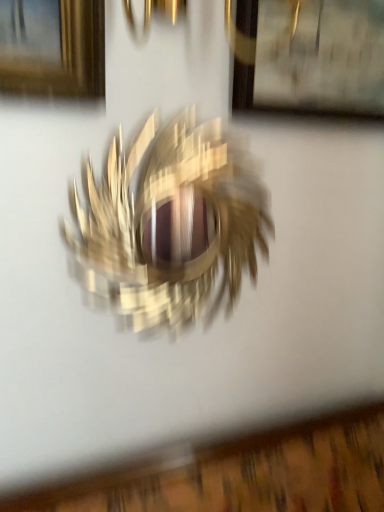
Question: In the image, is wooden picture frame at upper center positioned in front of or behind metallic gold bird at center?

Choices:
 (A) front
 (B) behind

Answer: (B)

Question: Is wooden picture frame at upper center bigger or smaller than metallic gold bird at center?

Choices:
 (A) small
 (B) big

Answer: (A)

Question: Is point (289, 51) positioned closer to the camera than point (213, 197)?

Choices:
 (A) farther
 (B) closer

Answer: (B)

Question: From a real-world perspective, relative to wooden picture frame at upper center, is metallic gold bird at center vertically above or below?

Choices:
 (A) below
 (B) above

Answer: (A)

Question: Is metallic gold bird at center to the left or to the right of wooden picture frame at upper center in the image?

Choices:
 (A) left
 (B) right

Answer: (A)

Question: In terms of size, does metallic gold bird at center appear bigger or smaller than wooden picture frame at upper center?

Choices:
 (A) small
 (B) big

Answer: (B)

Question: From their relative heights in the image, would you say metallic gold bird at center is taller or shorter than wooden picture frame at upper center?

Choices:
 (A) tall
 (B) short

Answer: (A)